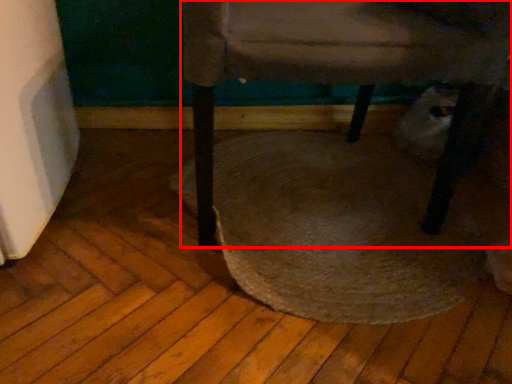
Question: In this image, where is chair (annotated by the red box) located relative to mat?

Choices:
 (A) left
 (B) right

Answer: (A)